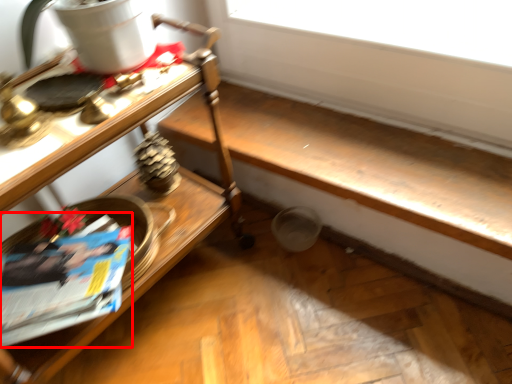
Question: Where is magazine (annotated by the red box) located in relation to table in the image?

Choices:
 (A) right
 (B) left

Answer: (B)